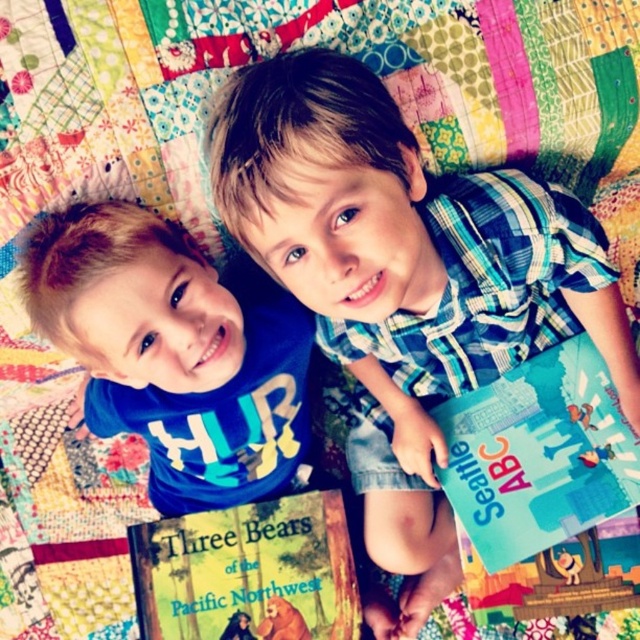
Question: Which point is closer to the camera taking this photo?

Choices:
 (A) (572, 397)
 (B) (268, 378)

Answer: (B)

Question: Which object is the closest to the teal glossy book at right?

Choices:
 (A) blue cotton shirt at left
 (B) hardcover book at center

Answer: (B)

Question: Does teal glossy book at right have a larger size compared to hardcover book at center?

Choices:
 (A) yes
 (B) no

Answer: (A)

Question: From the image, what is the correct spatial relationship of teal glossy book at right in relation to hardcover book at center?

Choices:
 (A) below
 (B) above

Answer: (B)

Question: Among these points, which one is farthest from the camera?

Choices:
 (A) (208, 612)
 (B) (214, 396)

Answer: (A)

Question: Can you confirm if teal glossy book at right is positioned below hardcover book at center?

Choices:
 (A) no
 (B) yes

Answer: (A)